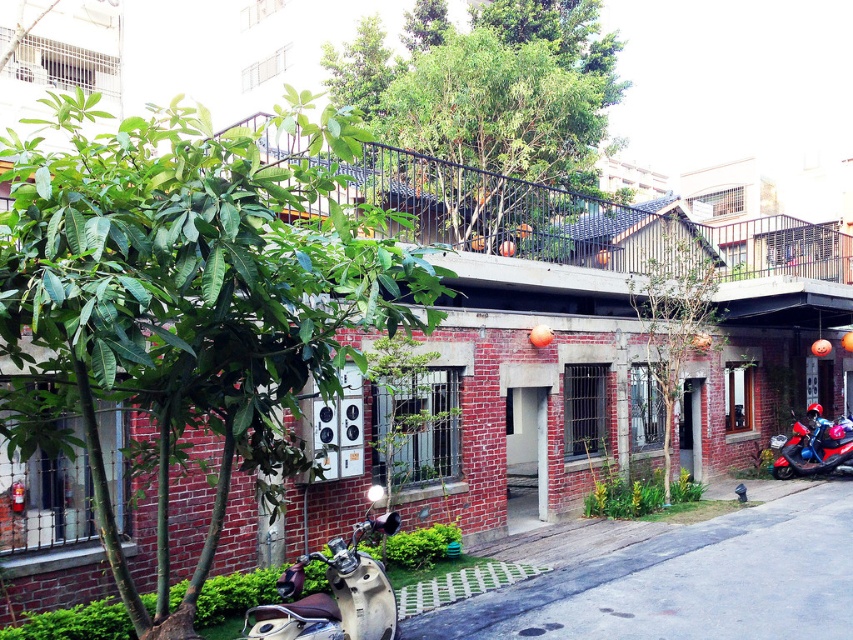
Based on the photo, does green leafy tree at center appear on the right side of beige leather motorcycle at lower left?

Indeed, green leafy tree at center is positioned on the right side of beige leather motorcycle at lower left.

Is green leafy tree at center below beige leather motorcycle at lower left?

No.

Who is more forward, [683,232] or [299,634]?

Positioned in front is point [299,634].

You are a GUI agent. You are given a task and a screenshot of the screen. Output one action in this format:
    pyautogui.click(x=<x>, y=<y>)
    Task: Click on the green leafy tree at center
    The image size is (853, 640).
    Given the screenshot: What is the action you would take?
    pyautogui.click(x=674, y=314)

Does green leafy tree at left appear under green leafy tree at center?

Yes.

Is green leafy tree at left bigger than green leafy tree at center?

Indeed, green leafy tree at left has a larger size compared to green leafy tree at center.

Between point (38, 316) and point (659, 323), which one is positioned behind?

Positioned behind is point (659, 323).

Where is `green leafy tree at left`? This screenshot has height=640, width=853. green leafy tree at left is located at coordinates (183, 307).

Looking at this image, is green leafy tree at left taller than shiny blue motorcycle at lower right?

Yes, green leafy tree at left is taller than shiny blue motorcycle at lower right.

The height and width of the screenshot is (640, 853). Describe the element at coordinates (183, 307) in the screenshot. I see `green leafy tree at left` at that location.

This screenshot has width=853, height=640. What do you see at coordinates (183, 307) in the screenshot?
I see `green leafy tree at left` at bounding box center [183, 307].

Find the location of a particular element. green leafy tree at left is located at coordinates (183, 307).